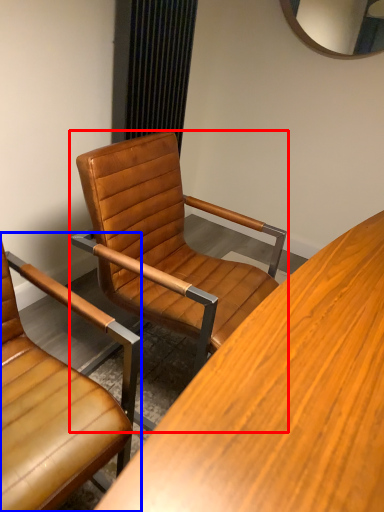
Question: Which object is closer to the camera taking this photo, chair (highlighted by a red box) or chair (highlighted by a blue box)?

Choices:
 (A) chair
 (B) chair

Answer: (B)